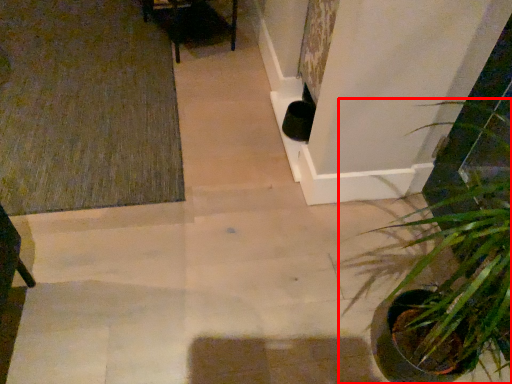
Question: Where is houseplant (annotated by the red box) located in relation to doormat in the image?

Choices:
 (A) right
 (B) left

Answer: (A)